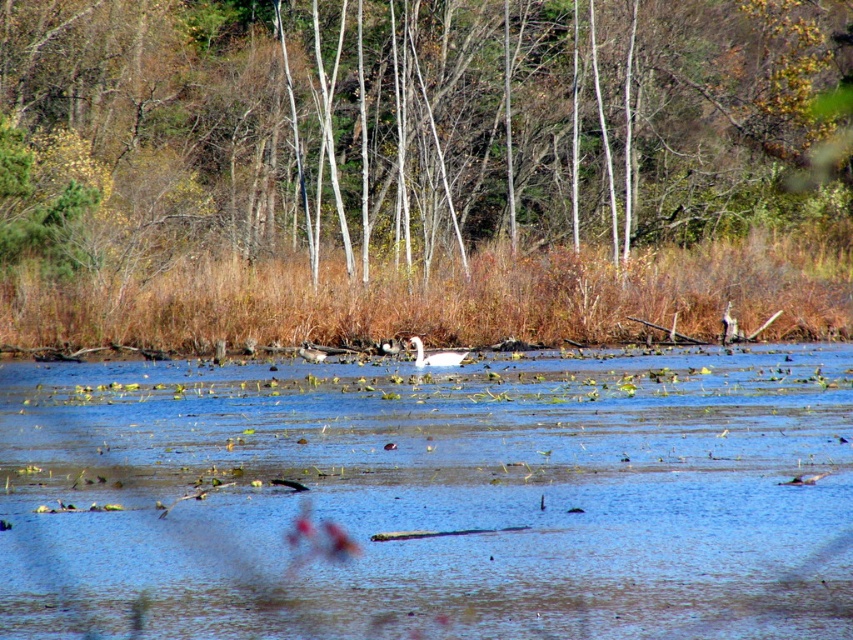
You are standing at the edge of the pond and want to throw a stone to hit both the clear blue water at center and the brown bark trees at upper center in one throw. Is this possible?

The clear blue water at center and the brown bark trees at upper center are 21.37 meters apart from each other. Since the distance between them is quite large, it would be extremely challenging to hit both in a single throw unless you have exceptional throwing skills.

You are an ornithologist observing the white glossy swan at center and the brown bark trees at upper center from a boat. Which object is taller when viewed from your position?

The brown bark trees at upper center are taller than the white glossy swan at center.